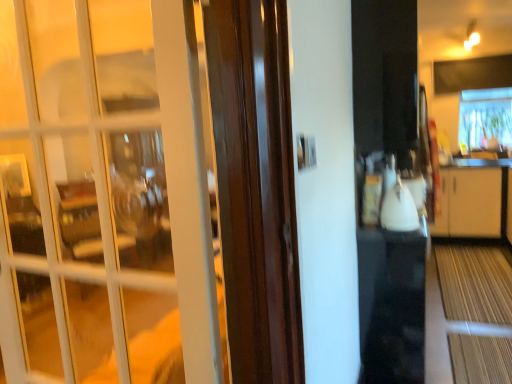
Question: From their relative heights in the image, would you say transparent plastic window at upper right is taller or shorter than white glass door at left?

Choices:
 (A) tall
 (B) short

Answer: (B)

Question: Based on their positions, is transparent plastic window at upper right located to the left or right of white glass door at left?

Choices:
 (A) left
 (B) right

Answer: (B)

Question: Which object is the closest to the white glossy kettle at center?

Choices:
 (A) white glass door at left
 (B) transparent plastic window at upper right

Answer: (A)

Question: Considering the real-world distances, which object is closest to the white glass door at left?

Choices:
 (A) transparent plastic window at upper right
 (B) white glossy kettle at center

Answer: (B)